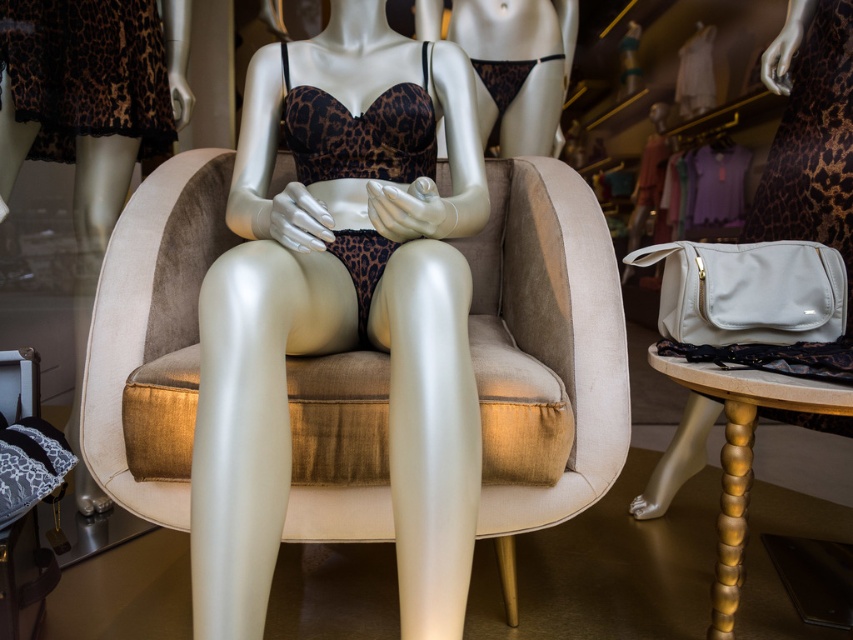
Question: Is leopard print fabric bra and panties at center bigger than beige velvet armchair at center?

Choices:
 (A) yes
 (B) no

Answer: (B)

Question: Which object appears closest to the camera in this image?

Choices:
 (A) leopard print fabric bra and panties at center
 (B) beige velvet armchair at center

Answer: (A)

Question: Which point appears closest to the camera in this image?

Choices:
 (A) (480, 515)
 (B) (299, 58)

Answer: (A)

Question: Can you confirm if leopard print fabric bra and panties at center is bigger than beige velvet armchair at center?

Choices:
 (A) no
 (B) yes

Answer: (A)

Question: Does leopard print fabric bra and panties at center appear on the right side of beige velvet armchair at center?

Choices:
 (A) no
 (B) yes

Answer: (B)

Question: Which of the following is the closest to the observer?

Choices:
 (A) beige velvet armchair at center
 (B) leopard print fabric bra and panties at center

Answer: (B)